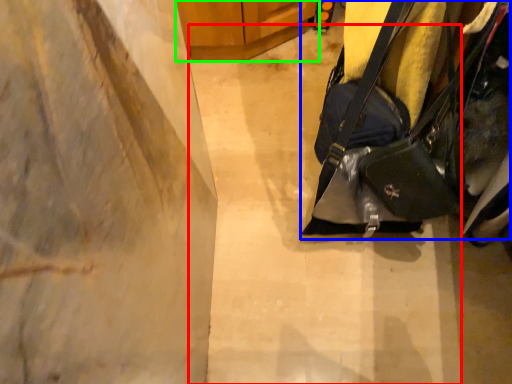
Question: Based on their relative distances, which object is nearer to concrete (highlighted by a red box)? Choose from handbag (highlighted by a blue box) and furniture (highlighted by a green box).

Choices:
 (A) handbag
 (B) furniture

Answer: (A)